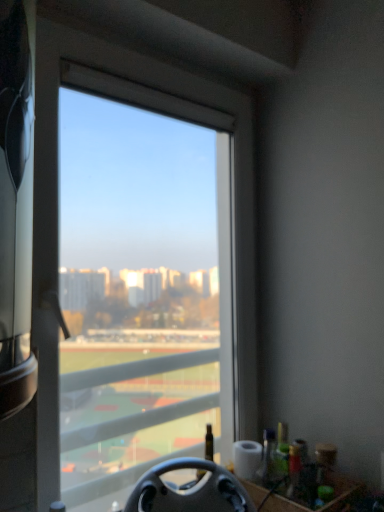
Question: Can you confirm if transparent glass window at center is positioned to the left of black matte steering wheel at lower center?

Choices:
 (A) yes
 (B) no

Answer: (A)

Question: Is transparent glass window at center positioned in front of black matte steering wheel at lower center?

Choices:
 (A) yes
 (B) no

Answer: (B)

Question: Are transparent glass window at center and black matte steering wheel at lower center making contact?

Choices:
 (A) yes
 (B) no

Answer: (B)

Question: Can we say transparent glass window at center lies outside black matte steering wheel at lower center?

Choices:
 (A) no
 (B) yes

Answer: (B)

Question: Could you tell me if transparent glass window at center is turned towards black matte steering wheel at lower center?

Choices:
 (A) no
 (B) yes

Answer: (B)

Question: Does transparent glass window at center have a larger size compared to black matte steering wheel at lower center?

Choices:
 (A) no
 (B) yes

Answer: (B)

Question: Can you confirm if black matte steering wheel at lower center is shorter than transparent glass window at center?

Choices:
 (A) yes
 (B) no

Answer: (A)

Question: Is black matte steering wheel at lower center oriented towards transparent glass window at center?

Choices:
 (A) yes
 (B) no

Answer: (B)

Question: Can you confirm if black matte steering wheel at lower center is smaller than transparent glass window at center?

Choices:
 (A) no
 (B) yes

Answer: (B)

Question: From the image's perspective, is black matte steering wheel at lower center located beneath transparent glass window at center?

Choices:
 (A) yes
 (B) no

Answer: (A)

Question: Is black matte steering wheel at lower center bigger than transparent glass window at center?

Choices:
 (A) yes
 (B) no

Answer: (B)

Question: Is black matte steering wheel at lower center positioned in front of transparent glass window at center?

Choices:
 (A) yes
 (B) no

Answer: (A)

Question: From the image's perspective, is black matte steering wheel at lower center located above or below transparent glass window at center?

Choices:
 (A) above
 (B) below

Answer: (B)